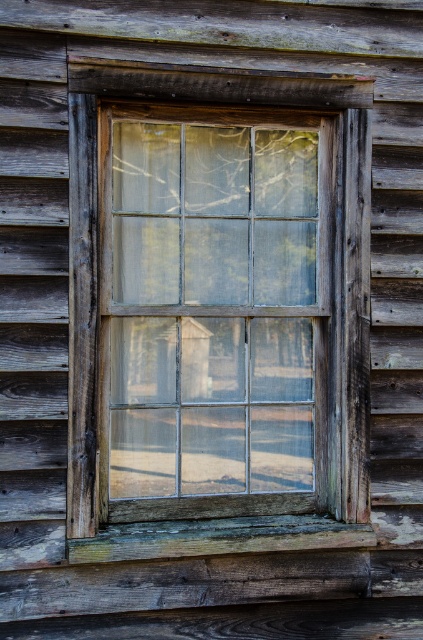
Based on the photo, you are an interior designer assessing the structural integrity of the wooden window. You notice the clear glass window at center and the weathered wood at lower center. Which object is positioned higher in the scene?

The clear glass window at center is located above the weathered wood at lower center, so it is positioned higher in the scene.

You are an interior designer assessing a room with a wooden wall. You notice the clear glass window at center and the weathered wood at lower center. Which object takes up more space in the scene?

The clear glass window at center is bigger than weathered wood at lower center, so it takes up more space in the scene.